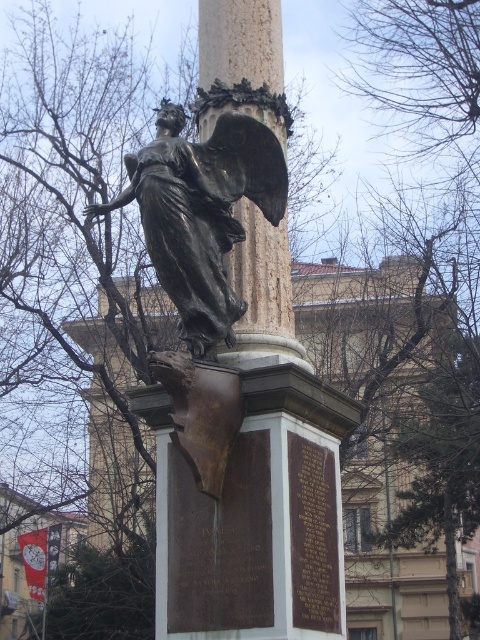
Looking at this image, you are standing at the origin point of the coordinate system. Where is the bronze statue at center located in terms of coordinates?

The bronze statue at center is located at coordinates point [202,212].